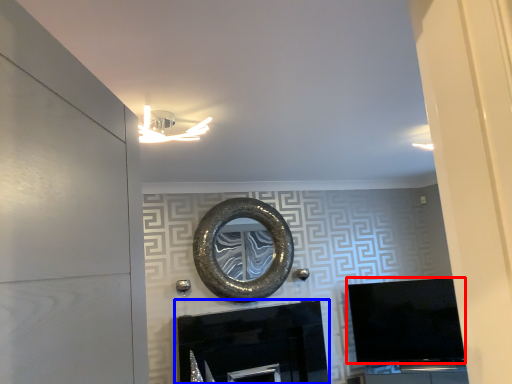
Question: Which object appears closest to the camera in this image, television (highlighted by a red box) or fireplace (highlighted by a blue box)?

Choices:
 (A) television
 (B) fireplace

Answer: (B)